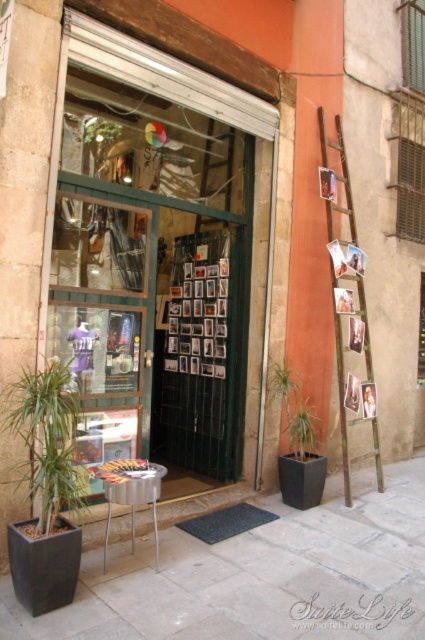
Find the location of a particular element. The width and height of the screenshot is (425, 640). transparent glass door at center is located at coordinates click(x=159, y=257).

Locate an element on the screen. This screenshot has width=425, height=640. transparent glass door at center is located at coordinates (159, 257).

Is point (217, 634) positioned in front of point (346, 474)?

Yes.

Who is more forward, (405, 518) or (339, 356)?

Point (405, 518) is in front.

The width and height of the screenshot is (425, 640). What are the coordinates of `smooth stone pavement at center` in the screenshot? It's located at (260, 577).

Image resolution: width=425 pixels, height=640 pixels. I want to click on transparent glass door at center, so click(x=159, y=257).

Can you confirm if transparent glass door at center is bigger than rustic wooden ladder at right?

Yes.

Does point (175, 196) come closer to viewer compared to point (377, 456)?

Yes.

This screenshot has height=640, width=425. I want to click on transparent glass door at center, so (x=159, y=257).